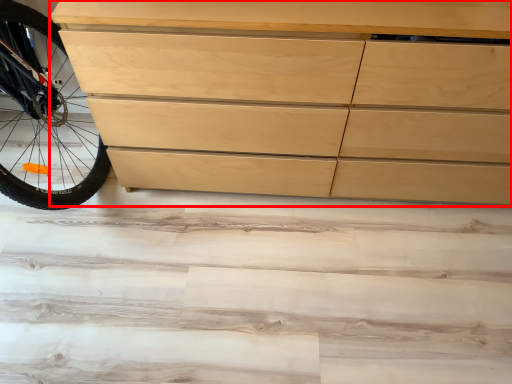
Question: From the image's perspective, considering the relative positions of chest of drawers (annotated by the red box) and stair in the image provided, where is chest of drawers (annotated by the red box) located with respect to the staircase?

Choices:
 (A) below
 (B) above

Answer: (B)